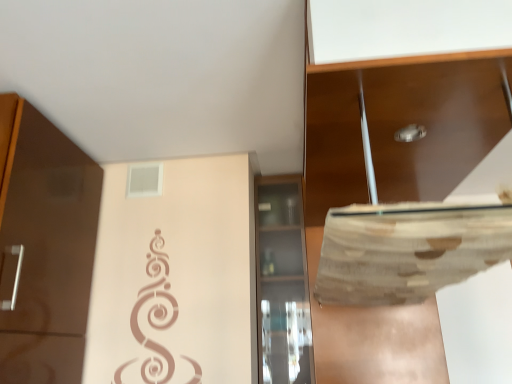
Question: Which direction should I rotate to look at transparent glass cabinet at center, marked as the second cabinetry in a top-to-bottom arrangement?

Choices:
 (A) right
 (B) left

Answer: (A)

Question: Is matte brown cabinet at upper right, which is counted as the first cabinetry, starting from the top, taller than transparent glass cabinet at center, marked as the second cabinetry in a top-to-bottom arrangement?

Choices:
 (A) yes
 (B) no

Answer: (B)

Question: Does matte brown cabinet at upper right, which is the 2th cabinetry in bottom-to-top order, contain transparent glass cabinet at center, which appears as the 1th cabinetry when ordered from the bottom?

Choices:
 (A) no
 (B) yes

Answer: (A)

Question: Can you confirm if matte brown cabinet at upper right, which is the 2th cabinetry in bottom-to-top order, is shorter than transparent glass cabinet at center, marked as the second cabinetry in a top-to-bottom arrangement?

Choices:
 (A) no
 (B) yes

Answer: (B)

Question: Does matte brown cabinet at upper right, which is counted as the first cabinetry, starting from the top, have a larger size compared to transparent glass cabinet at center, which appears as the 1th cabinetry when ordered from the bottom?

Choices:
 (A) no
 (B) yes

Answer: (B)

Question: Does matte brown cabinet at upper right, which is the 2th cabinetry in bottom-to-top order, have a greater width compared to transparent glass cabinet at center, which appears as the 1th cabinetry when ordered from the bottom?

Choices:
 (A) yes
 (B) no

Answer: (A)

Question: From a real-world perspective, is matte brown cabinet at upper right, which is counted as the first cabinetry, starting from the top, on transparent glass cabinet at center, which appears as the 1th cabinetry when ordered from the bottom?

Choices:
 (A) yes
 (B) no

Answer: (A)

Question: Does transparent glass cabinet at center, which appears as the 1th cabinetry when ordered from the bottom, turn towards matte brown cabinet at upper right, which is the 2th cabinetry in bottom-to-top order?

Choices:
 (A) yes
 (B) no

Answer: (B)

Question: Does transparent glass cabinet at center, marked as the second cabinetry in a top-to-bottom arrangement, have a larger size compared to matte brown cabinet at upper right, which is the 2th cabinetry in bottom-to-top order?

Choices:
 (A) no
 (B) yes

Answer: (A)

Question: Can you see transparent glass cabinet at center, which appears as the 1th cabinetry when ordered from the bottom, touching matte brown cabinet at upper right, which is the 2th cabinetry in bottom-to-top order?

Choices:
 (A) yes
 (B) no

Answer: (B)

Question: Is transparent glass cabinet at center, which appears as the 1th cabinetry when ordered from the bottom, positioned in front of matte brown cabinet at upper right, which is the 2th cabinetry in bottom-to-top order?

Choices:
 (A) yes
 (B) no

Answer: (B)

Question: Is transparent glass cabinet at center, marked as the second cabinetry in a top-to-bottom arrangement, outside of matte brown cabinet at upper right, which is counted as the first cabinetry, starting from the top?

Choices:
 (A) no
 (B) yes

Answer: (B)

Question: Is matte brown cabinet at upper right, which is counted as the first cabinetry, starting from the top, surrounded by transparent glass cabinet at center, which appears as the 1th cabinetry when ordered from the bottom?

Choices:
 (A) no
 (B) yes

Answer: (A)

Question: In terms of height, does transparent glass cabinet at center, marked as the second cabinetry in a top-to-bottom arrangement, look taller or shorter compared to matte brown cabinet at upper right, which is the 2th cabinetry in bottom-to-top order?

Choices:
 (A) tall
 (B) short

Answer: (A)